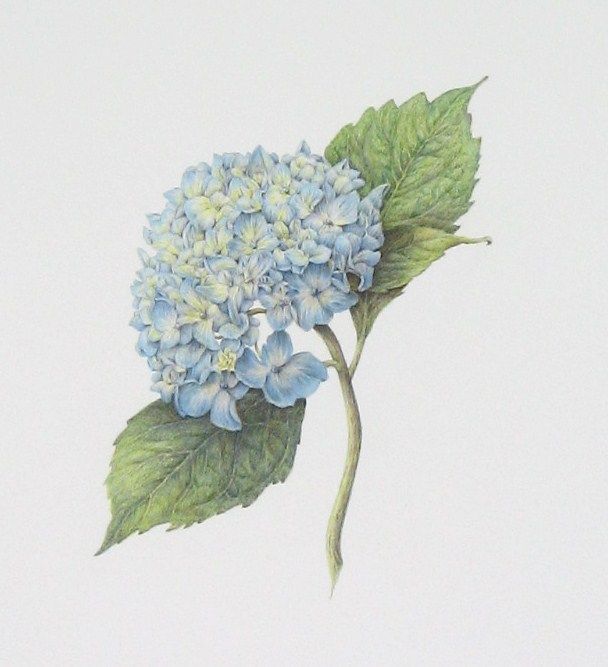
You are a GUI agent. You are given a task and a screenshot of the screen. Output one action in this format:
    pyautogui.click(x=<x>, y=<y>)
    Task: Click on the canvas
    This screenshot has height=667, width=608.
    Given the screenshot: What is the action you would take?
    pyautogui.click(x=139, y=143)